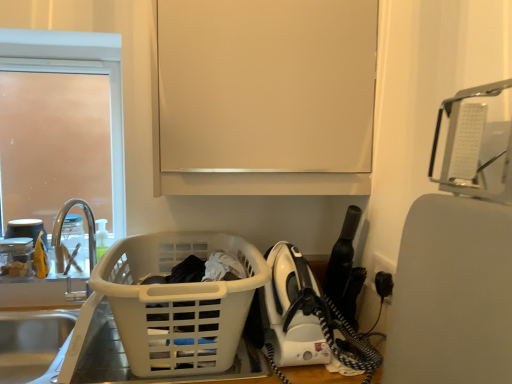
At what (x,y) coordinates should I click in order to perform the action: click on translucent plastic bottle at sink left. Please return your answer as a coordinate pair (x, y). The width and height of the screenshot is (512, 384). Looking at the image, I should click on (73, 239).

What do you see at coordinates (61, 231) in the screenshot? I see `clear glass faucet at left` at bounding box center [61, 231].

Measure the distance between point (47, 357) and camera.

They are 1.45 meters apart.

The image size is (512, 384). What do you see at coordinates (305, 318) in the screenshot? I see `white plastic iron at lower right` at bounding box center [305, 318].

This screenshot has height=384, width=512. What do you see at coordinates (77, 72) in the screenshot?
I see `frosted glass door at upper left` at bounding box center [77, 72].

Where is `translucent plastic bottle at sink left`? This screenshot has height=384, width=512. translucent plastic bottle at sink left is located at coordinates (73, 239).

Considering the points (370, 59) and (321, 343), which point is behind, point (370, 59) or point (321, 343)?

Point (370, 59)

Locate an element on the screen. home appliance located on the right of matte white cabinet at upper center is located at coordinates (305, 318).

Considering the sizes of matte white cabinet at upper center and white plastic iron at lower right in the image, is matte white cabinet at upper center wider or thinner than white plastic iron at lower right?

Considering their sizes, matte white cabinet at upper center looks slimmer than white plastic iron at lower right.

Does clear glass faucet at left have a larger size compared to white plastic laundry basket at lower left?

Actually, clear glass faucet at left might be smaller than white plastic laundry basket at lower left.

This screenshot has width=512, height=384. Identify the location of basket lying in front of the clear glass faucet at left. (177, 302).

Is point (95, 257) more distant than point (209, 241)?

That is True.

This screenshot has height=384, width=512. Find the location of `the 2nd sink counting from the left of the white plastic laundry basket at lower left`. the 2nd sink counting from the left of the white plastic laundry basket at lower left is located at coordinates (31, 341).

Consider the image. Who is more distant, white plastic laundry basket at lower left or silver metallic sink at lower left, which ranks as the first sink in bottom-to-top order?

Positioned behind is silver metallic sink at lower left, which ranks as the first sink in bottom-to-top order.

From a real-world perspective, is white plastic laundry basket at lower left over silver metallic sink at lower left, which ranks as the first sink in bottom-to-top order?

Yes, from a real-world perspective, white plastic laundry basket at lower left is above silver metallic sink at lower left, which ranks as the first sink in bottom-to-top order.

Is silver metallic sink at lower left, arranged as the 2th sink when viewed from the top, a part of white plastic laundry basket at lower left?

Definitely not — silver metallic sink at lower left, arranged as the 2th sink when viewed from the top, is not inside white plastic laundry basket at lower left.

Consider the image. Which point is more forward, [58,216] or [28,43]?

The point [28,43] is in front.

From the image's perspective, who appears lower, clear glass faucet at left or frosted glass door at upper left?

clear glass faucet at left is shown below in the image.

Is clear glass faucet at left closer to camera compared to frosted glass door at upper left?

Yes, clear glass faucet at left is closer to the camera.

From a real-world perspective, does clear glass faucet at left sit lower than frosted glass door at upper left?

Correct, in the physical world, clear glass faucet at left is lower than frosted glass door at upper left.

Does white plastic laundry basket at lower left have a greater height compared to frosted glass door at upper left?

No.

Between white plastic laundry basket at lower left and frosted glass door at upper left, which one appears on the right side from the viewer's perspective?

white plastic laundry basket at lower left is more to the right.

Does white plastic laundry basket at lower left have a larger size compared to frosted glass door at upper left?

Yes, white plastic laundry basket at lower left is bigger than frosted glass door at upper left.

From the image's perspective, is white plastic laundry basket at lower left positioned above or below frosted glass door at upper left?

white plastic laundry basket at lower left is situated lower than frosted glass door at upper left in the image.

Could you tell me if white plastic iron at lower right is facing clear glass faucet at left?

No.

Considering the sizes of white plastic iron at lower right and clear glass faucet at left in the image, is white plastic iron at lower right bigger or smaller than clear glass faucet at left?

Considering their sizes, white plastic iron at lower right takes up more space than clear glass faucet at left.

Considering their positions, is white plastic iron at lower right located in front of or behind clear glass faucet at left?

Visually, white plastic iron at lower right is located in front of clear glass faucet at left.

Which of these two, matte white cabinet at upper center or translucent plastic bottle at sink left, is bigger?

With larger size is matte white cabinet at upper center.

From the picture: From a real-world perspective, is matte white cabinet at upper center on top of translucent plastic bottle at sink left?

Yes.

Considering the sizes of objects matte white cabinet at upper center and translucent plastic bottle at sink left in the image provided, who is taller, matte white cabinet at upper center or translucent plastic bottle at sink left?

matte white cabinet at upper center is taller.

Is translucent plastic bottle at sink left at the back of matte white cabinet at upper center?

No, matte white cabinet at upper center is not facing the opposite direction of translucent plastic bottle at sink left.

The height and width of the screenshot is (384, 512). Find the location of `home appliance directly beneath the matte white cabinet at upper center (from a real-world perspective)`. home appliance directly beneath the matte white cabinet at upper center (from a real-world perspective) is located at coordinates (305, 318).

The height and width of the screenshot is (384, 512). What are the coordinates of `faucet that is above the white plastic laundry basket at lower left (from the image's perspective)` in the screenshot? It's located at (61, 231).

Estimate the real-world distances between objects in this image. Which object is further from silver metallic sink at lower left, arranged as the 2th sink when viewed from the top, translucent plastic bottle at sink left or white plastic laundry basket at lower left?

Based on the image, white plastic laundry basket at lower left appears to be further to silver metallic sink at lower left, arranged as the 2th sink when viewed from the top.

Estimate the real-world distances between objects in this image. Which object is further from white plastic iron at lower right, silver metallic sink at lower left, which ranks as the first sink in bottom-to-top order, or clear glass faucet at left?

Among the two, clear glass faucet at left is located further to white plastic iron at lower right.

When comparing their distances from translucent plastic bottle at sink left, does white plastic laundry basket at lower left or white plastic iron at lower right seem closer?

white plastic laundry basket at lower left.

Based on the photo, based on their spatial positions, is matte white cabinet at upper center or white plastic iron at lower right closer to brushed metal sink at left, which is the second sink in bottom-to-top order?

matte white cabinet at upper center lies closer to brushed metal sink at left, which is the second sink in bottom-to-top order, than the other object.

Based on their spatial positions, is matte white cabinet at upper center or clear glass faucet at left further from white plastic laundry basket at lower left?

clear glass faucet at left is positioned further to the anchor white plastic laundry basket at lower left.

Looking at the image, which one is located further to translucent plastic bottle at sink left, frosted glass door at upper left or white plastic iron at lower right?

Among the two, white plastic iron at lower right is located further to translucent plastic bottle at sink left.

Based on the photo, based on their spatial positions, is silver metallic sink at lower left, arranged as the 2th sink when viewed from the top, or brushed metal sink at left, which is the second sink in bottom-to-top order, closer to white plastic laundry basket at lower left?

brushed metal sink at left, which is the second sink in bottom-to-top order.

When comparing their distances from white plastic iron at lower right, does white plastic laundry basket at lower left or matte white cabinet at upper center seem further?

matte white cabinet at upper center lies further to white plastic iron at lower right than the other object.

Image resolution: width=512 pixels, height=384 pixels. What are the coordinates of `sink between silver metallic sink at lower left, which ranks as the first sink in bottom-to-top order, and frosted glass door at upper left, along the z-axis` in the screenshot? It's located at (41, 309).

Where is `bottle situated between clear glass faucet at left and matte white cabinet at upper center from left to right`? The width and height of the screenshot is (512, 384). bottle situated between clear glass faucet at left and matte white cabinet at upper center from left to right is located at coordinates (73, 239).

The width and height of the screenshot is (512, 384). I want to click on sink located between translucent plastic bottle at sink left and matte white cabinet at upper center in the left-right direction, so click(x=41, y=309).

Identify the location of faucet positioned between brushed metal sink at left, which is the second sink in bottom-to-top order, and frosted glass door at upper left from near to far. (61, 231).